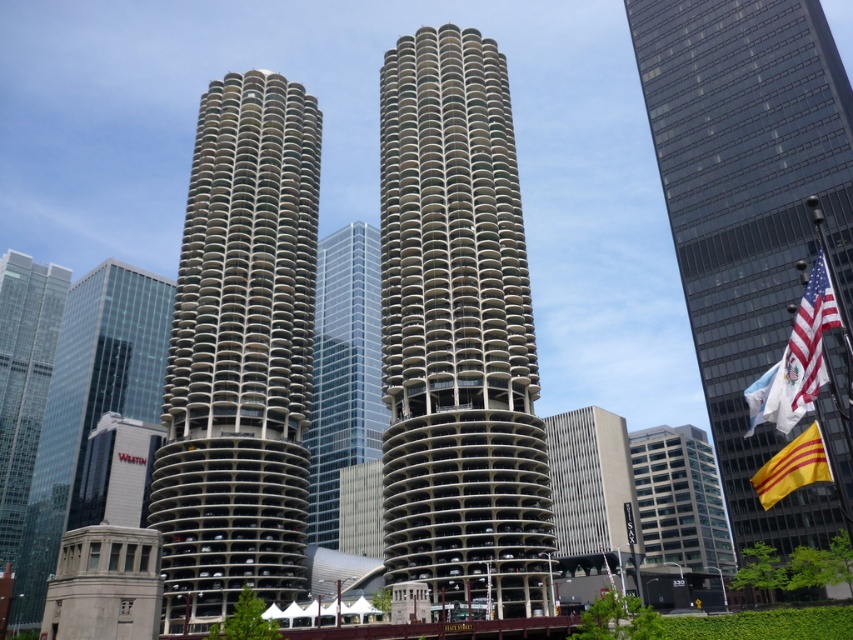
Does american flag at right have a greater width compared to yellowmaterial/textureflag at right?

Yes, american flag at right is wider than yellowmaterial/textureflag at right.

Which is behind, point (785, 426) or point (799, 456)?

Positioned behind is point (799, 456).

Locate an element on the screen. The width and height of the screenshot is (853, 640). american flag at right is located at coordinates (798, 358).

Does concrete textured building at center appear under yellowmaterial/textureflag at right?

No.

Is point (271, 486) farther from camera compared to point (782, 492)?

Yes, point (271, 486) is farther from viewer.

Locate an element on the screen. The image size is (853, 640). concrete textured building at center is located at coordinates (241, 355).

Does concrete textured building at center have a lesser width compared to american flag at right?

No, concrete textured building at center is not thinner than american flag at right.

Identify the location of concrete textured building at center. (241, 355).